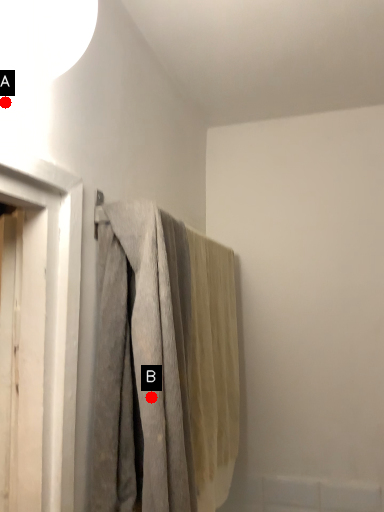
Question: Two points are circled on the image, labeled by A and B beside each circle. Which point appears closest to the camera in this image?

Choices:
 (A) A is closer
 (B) B is closer

Answer: (A)